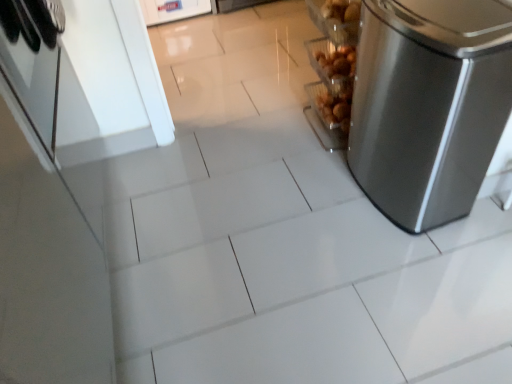
Image resolution: width=512 pixels, height=384 pixels. I want to click on free space in front of satin silver trash can at right, so click(x=423, y=263).